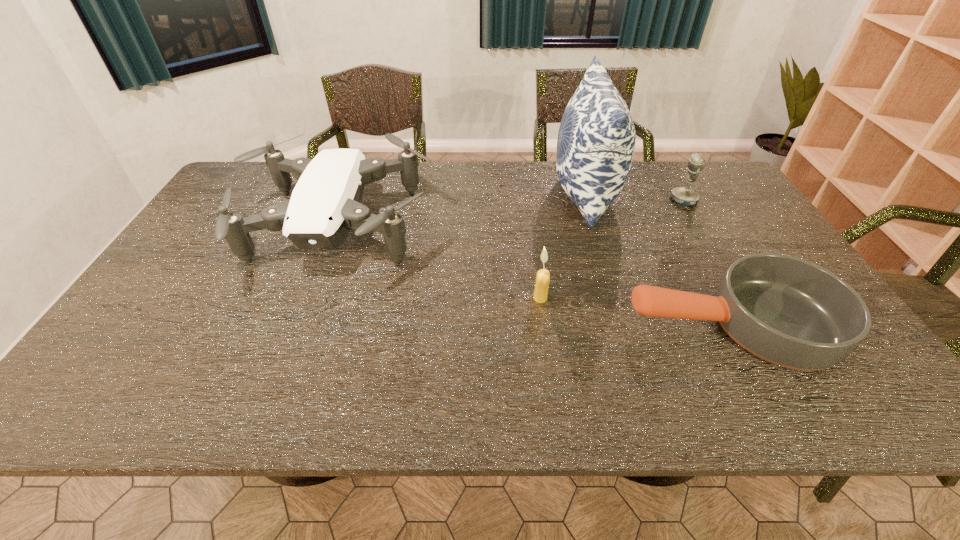
Find the location of a particular element. cushion is located at coordinates (596, 140).

Identify the location of drone. The width and height of the screenshot is (960, 540). click(325, 205).

The image size is (960, 540). In order to click on the second object from left to right in this screenshot , I will do point(543,276).

Locate an element on the screen. Image resolution: width=960 pixels, height=540 pixels. microphone is located at coordinates [x=686, y=196].

Find the location of a particular element. pan is located at coordinates (784, 310).

In order to click on vacant position located on the front surface of the cushion in this screenshot , I will do `click(493, 194)`.

This screenshot has width=960, height=540. Identify the location of vacant space positioned 0.200m on the front surface of the cushion. (490, 194).

Identify the location of vacant space located 0.240m on the front surface of the cushion. This screenshot has width=960, height=540. click(478, 194).

The width and height of the screenshot is (960, 540). I want to click on free space located on the camera side of the leftmost object, so click(284, 367).

The image size is (960, 540). In order to click on free space located 0.240m on the right of the candle in this screenshot , I will do `click(644, 298)`.